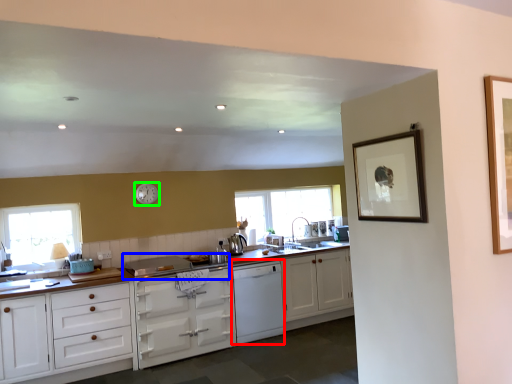
Question: Considering the real-world distances, which object is closest to dish washer (highlighted by a red box)? gas stove (highlighted by a blue box) or clock (highlighted by a green box).

Choices:
 (A) gas stove
 (B) clock

Answer: (A)